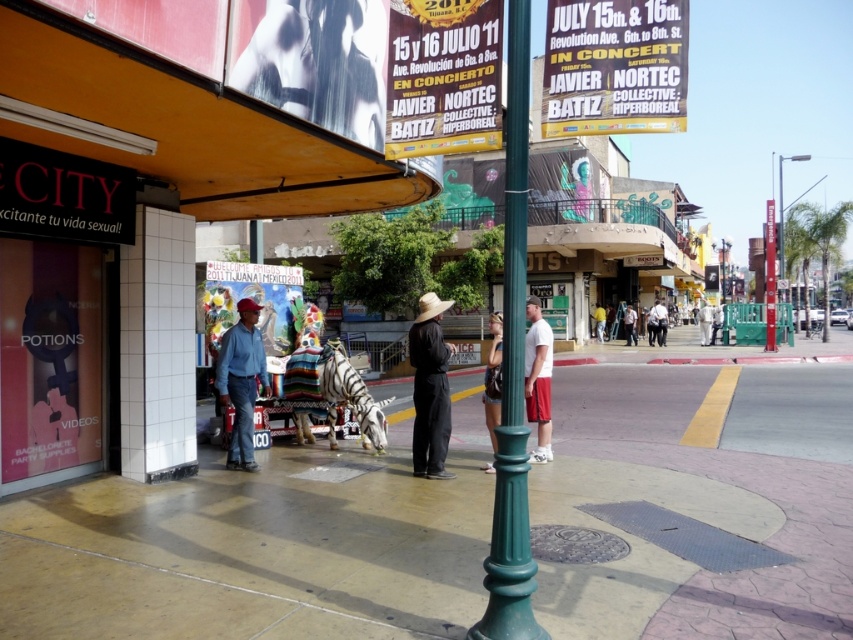
Which is more to the left, metallic pole at upper right or white fabric pants at center?

From the viewer's perspective, white fabric pants at center appears more on the left side.

Is metallic pole at upper right above white fabric pants at center?

Yes.

Where is `metallic pole at upper right`? This screenshot has width=853, height=640. metallic pole at upper right is located at coordinates (782, 209).

Describe the element at coordinates (492, 378) in the screenshot. The height and width of the screenshot is (640, 853). I see `matte black shorts at center` at that location.

Is matte black shorts at center wider than yellow fabric bag at center?

Correct, the width of matte black shorts at center exceeds that of yellow fabric bag at center.

Identify the location of matte black shorts at center. Image resolution: width=853 pixels, height=640 pixels. (492, 378).

The image size is (853, 640). Identify the location of matte black shorts at center. tap(492, 378).

In the scene shown: Does green painted metal pole at center appear under white fabric pants at center?

Indeed, green painted metal pole at center is positioned under white fabric pants at center.

Based on the photo, can you confirm if green painted metal pole at center is positioned to the left of white fabric pants at center?

Correct, you'll find green painted metal pole at center to the left of white fabric pants at center.

Is point (505, 150) positioned before point (717, 310)?

Yes, point (505, 150) is in front of point (717, 310).

At what (x,y) coordinates should I click in order to perform the action: click on green painted metal pole at center. Please return your answer as a coordinate pair (x, y). Looking at the image, I should click on (512, 376).